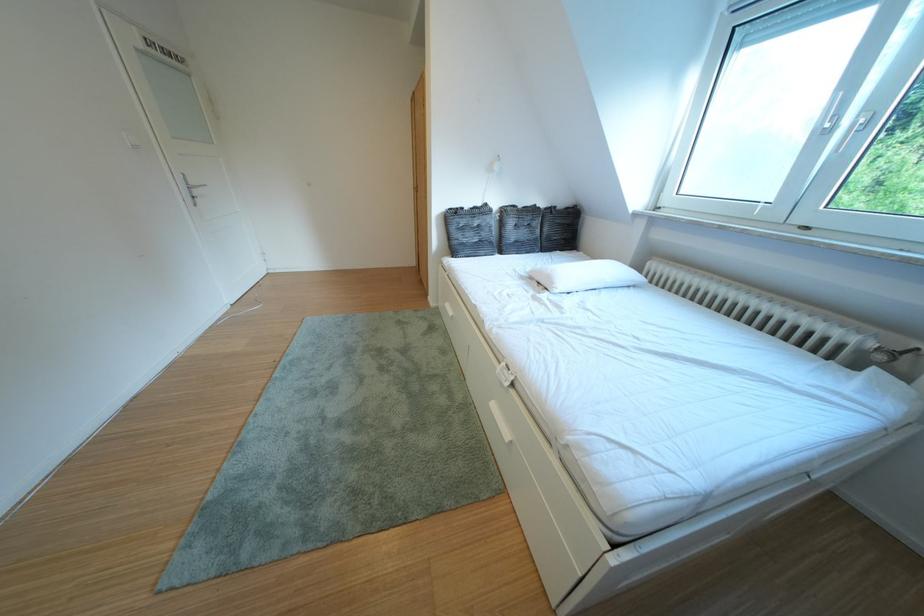
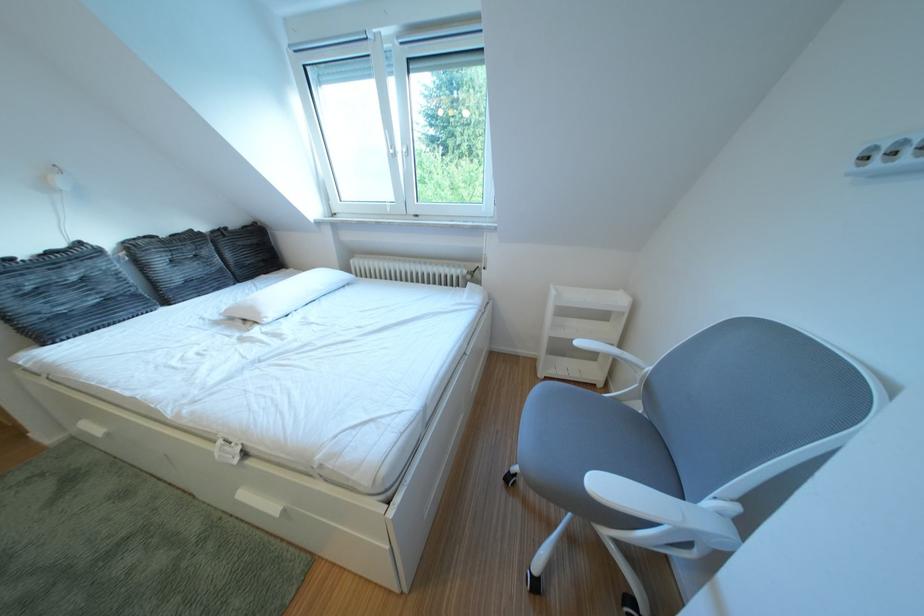
Find the pixel in the second image that matches pixel 533 211 in the first image.

(176, 240)